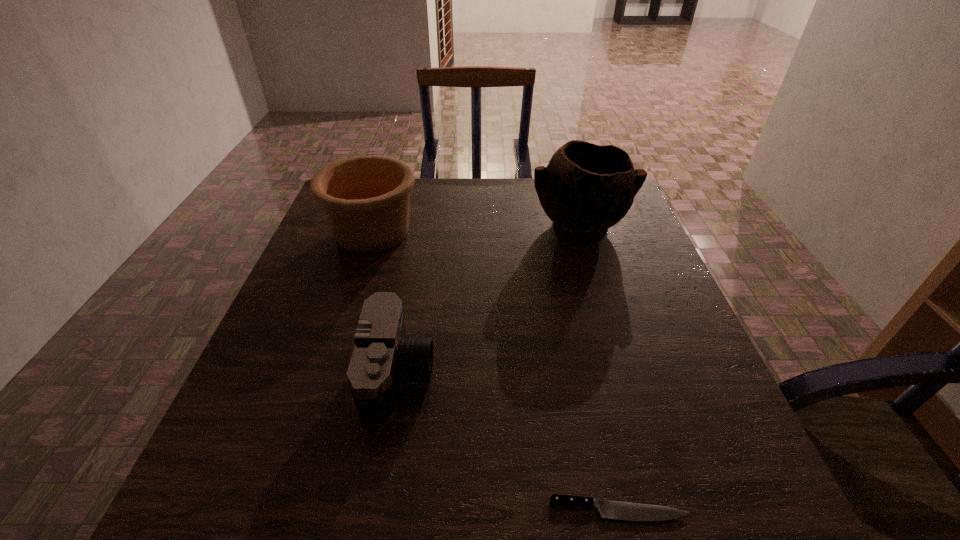
I want to click on free space at the near edge of the desktop, so click(598, 491).

Where is `vacant area at the left edge`? This screenshot has height=540, width=960. vacant area at the left edge is located at coordinates (309, 359).

You are a GUI agent. You are given a task and a screenshot of the screen. Output one action in this format:
    pyautogui.click(x=<x>, y=<y>)
    Task: Click on the free space at the near left corner
    Image resolution: width=960 pixels, height=540 pixels.
    Given the screenshot: What is the action you would take?
    pyautogui.click(x=214, y=471)

Where is `vacant region at the near right corner of the desktop`? Image resolution: width=960 pixels, height=540 pixels. vacant region at the near right corner of the desktop is located at coordinates (754, 501).

The width and height of the screenshot is (960, 540). Identify the location of unoccupied area between the shortest object and the shorter pottery. (496, 371).

The height and width of the screenshot is (540, 960). Identify the location of empty space between the shortest object and the second tallest object. (496, 371).

Image resolution: width=960 pixels, height=540 pixels. Find the location of `vacant point located between the right pottery and the nearest object`. vacant point located between the right pottery and the nearest object is located at coordinates point(600,368).

Where is `free space between the left pottery and the nearest object`? The width and height of the screenshot is (960, 540). free space between the left pottery and the nearest object is located at coordinates (496, 371).

Where is `empty location between the shorter pottery and the tallest object`? empty location between the shorter pottery and the tallest object is located at coordinates (476, 230).

The height and width of the screenshot is (540, 960). Identify the location of free space between the nearest object and the shorter pottery. (496, 371).